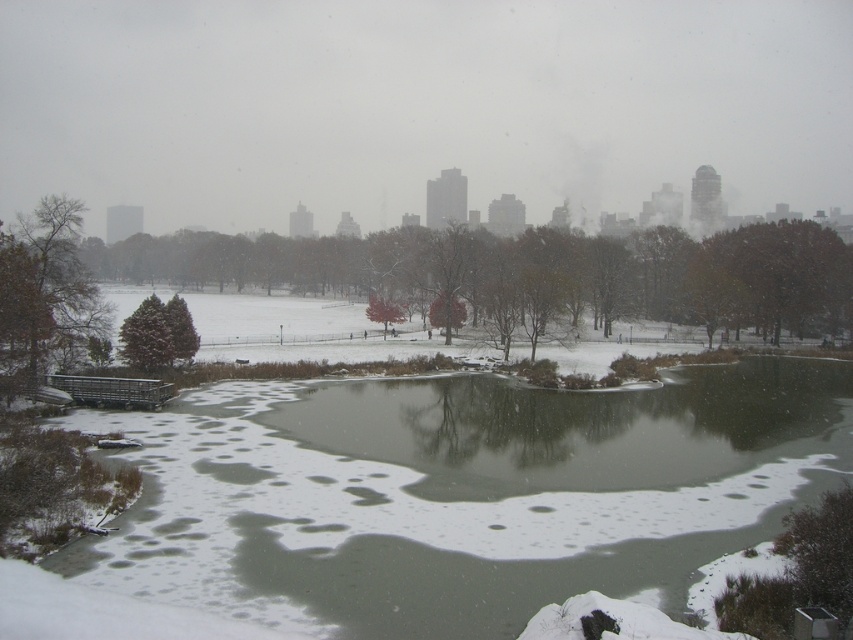
You are standing in the winter park scene and notice two green trees at the center. Which one is closer to you, the green matte tree at center or the green leafy tree at center?

The green matte tree at center is closer to you because it is positioned in front of the green leafy tree at center.